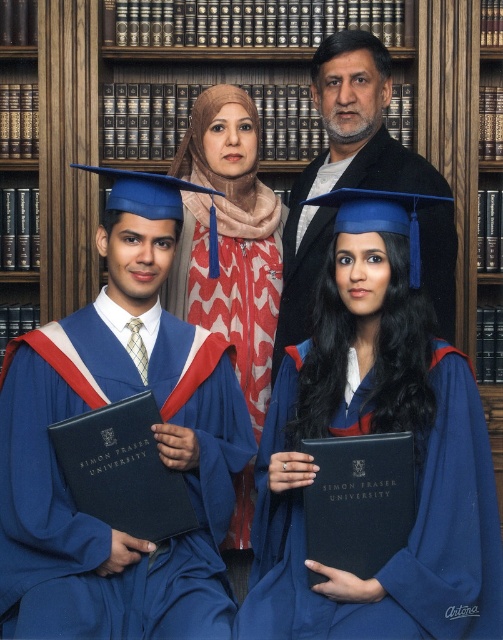
Question: Which object is the farthest from the matte blue hijab at center?

Choices:
 (A) matte black jacket at center
 (B) blue matte graduation gown at center

Answer: (B)

Question: Which of the following is the closest to the observer?

Choices:
 (A) 445,369
 (B) 264,244
 (C) 272,372

Answer: (A)

Question: Considering the relative positions of blue matte graduation gown at center and matte blue hijab at center in the image provided, where is blue matte graduation gown at center located with respect to matte blue hijab at center?

Choices:
 (A) above
 (B) below

Answer: (B)

Question: From the image, what is the correct spatial relationship of matte blue hijab at center in relation to matte black jacket at center?

Choices:
 (A) right
 (B) left

Answer: (B)

Question: Is the position of matte blue gown at center more distant than that of matte blue hijab at center?

Choices:
 (A) no
 (B) yes

Answer: (A)

Question: Which object appears farthest from the camera in this image?

Choices:
 (A) matte blue gown at center
 (B) matte black jacket at center
 (C) blue matte graduation gown at center

Answer: (B)